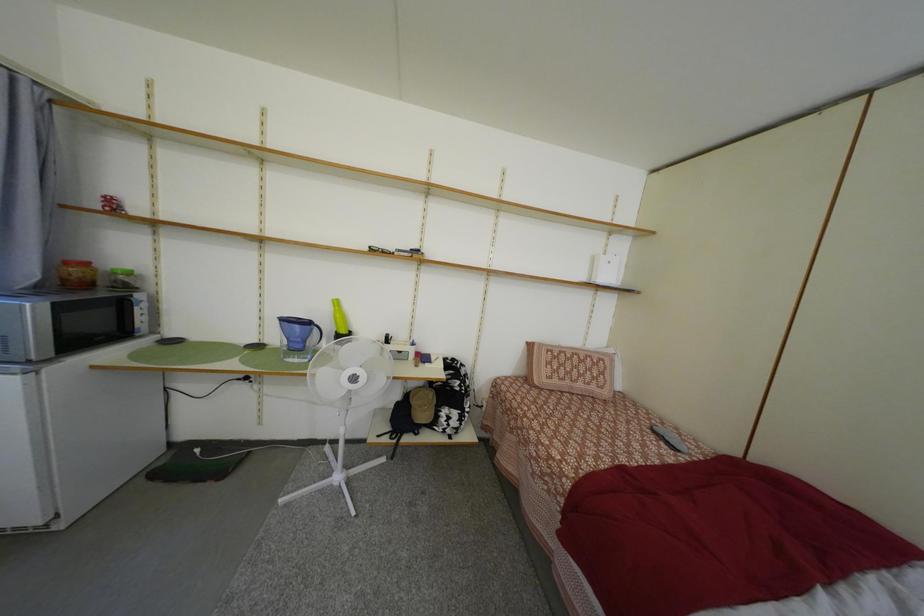
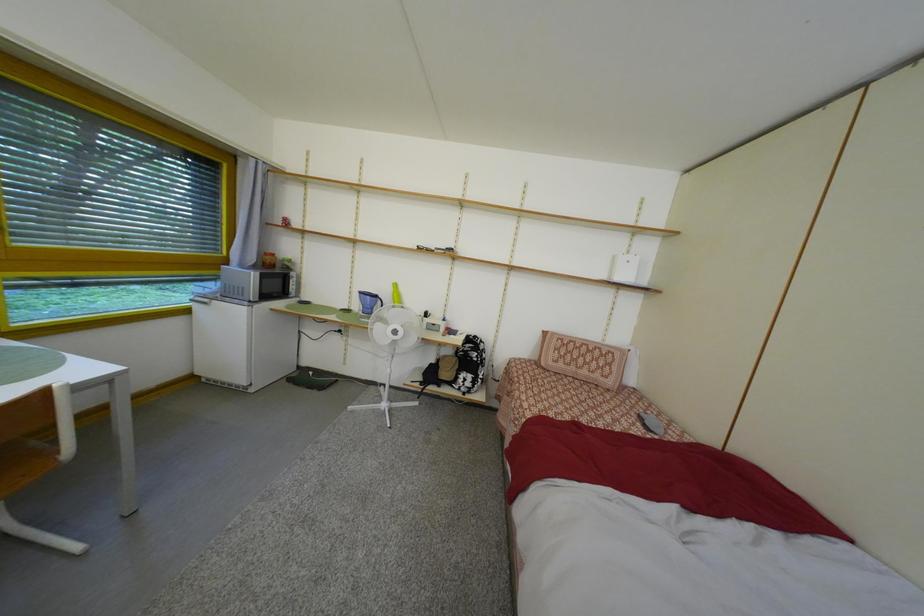
Which direction would the cameraman need to move to produce the second image?

The cameraman moved toward right, backward.